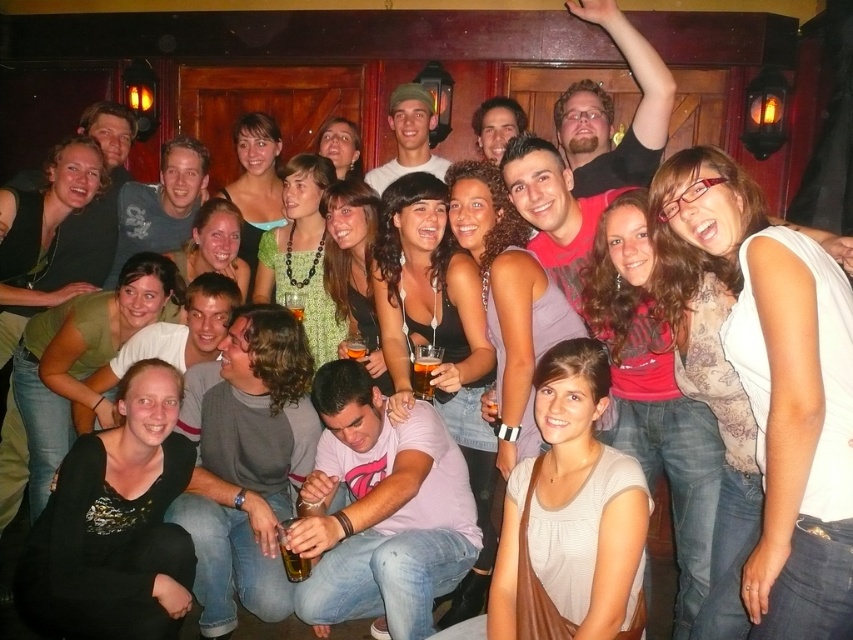
Between matte blue shirt at center and translucent glass beverage at center, which one is positioned higher?

Positioned higher is matte blue shirt at center.

Based on the photo, is matte blue shirt at center shorter than translucent glass beverage at center?

In fact, matte blue shirt at center may be taller than translucent glass beverage at center.

Identify the location of matte blue shirt at center. The image size is (853, 640). (161, 204).

Is matte green cap at upper center smaller than translucent glass beer at center?

No, matte green cap at upper center is not smaller than translucent glass beer at center.

Does point (399, 122) lie in front of point (287, 307)?

No, (399, 122) is further to viewer.

Identify the location of matte green cap at upper center. (409, 136).

Does matte blue shirt at center have a larger size compared to amber glass beer at center?

Indeed, matte blue shirt at center has a larger size compared to amber glass beer at center.

What do you see at coordinates (161, 204) in the screenshot?
I see `matte blue shirt at center` at bounding box center [161, 204].

What do you see at coordinates (161, 204) in the screenshot? I see `matte blue shirt at center` at bounding box center [161, 204].

Find the location of a particular element. This screenshot has height=640, width=853. matte blue shirt at center is located at coordinates (161, 204).